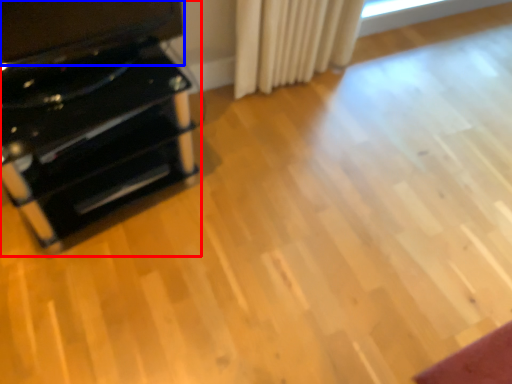
Question: Which of the following is the closest to the observer, furniture (highlighted by a red box) or wide (highlighted by a blue box)?

Choices:
 (A) furniture
 (B) wide

Answer: (B)